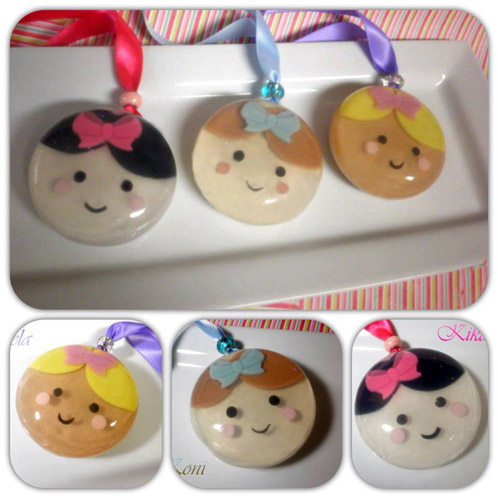
Identify the location of table. (391, 291), (291, 324).